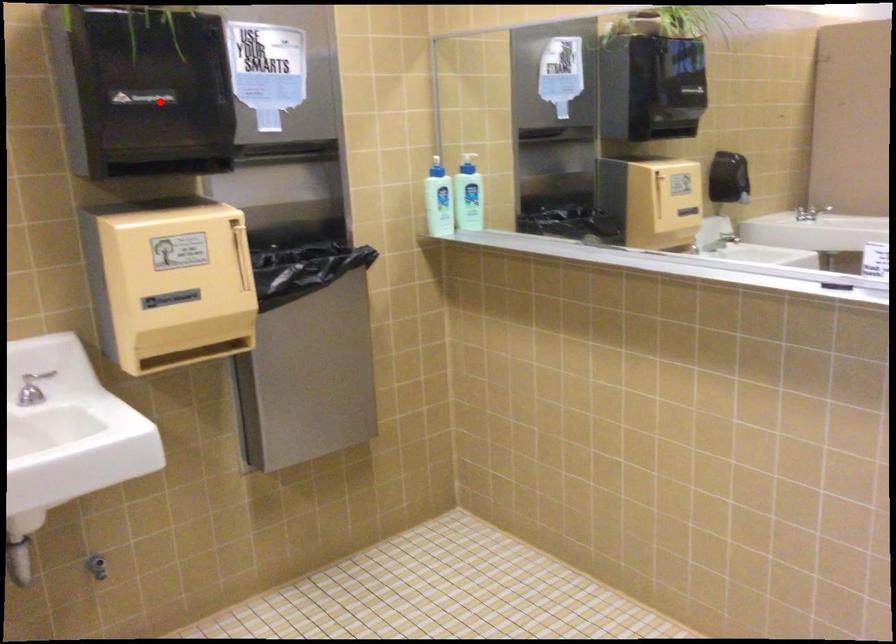
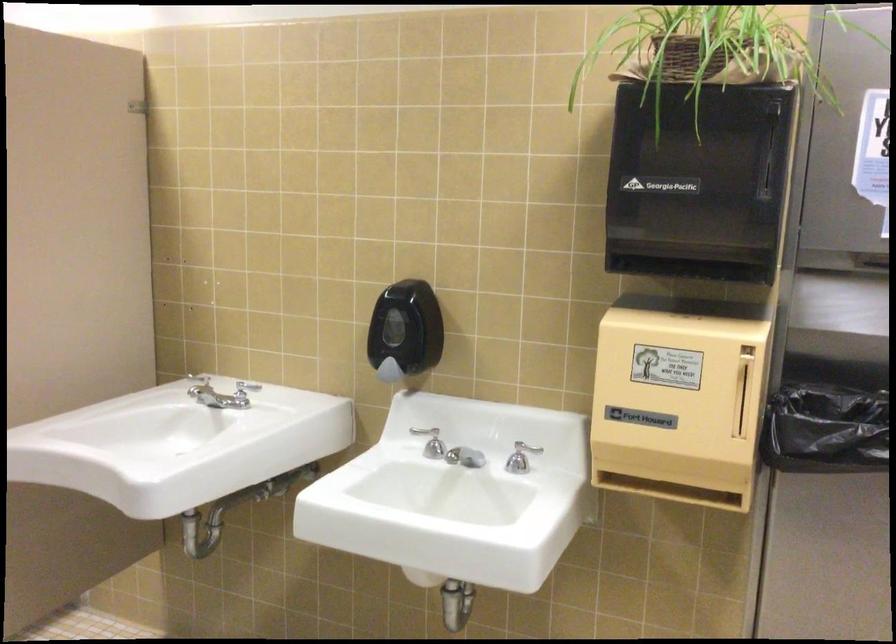
The point at the highlighted location is marked in the first image. Where is the corresponding point in the second image?

(698, 182)